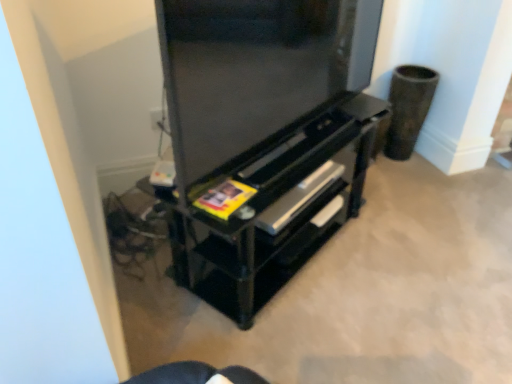
What do you see at coordinates (264, 137) in the screenshot? This screenshot has width=512, height=384. I see `black glossy tv stand at center` at bounding box center [264, 137].

The image size is (512, 384). Find the location of `black glossy tv stand at center`. black glossy tv stand at center is located at coordinates (264, 137).

Consider the image. What is the approximate height of black glossy tv stand at center?

black glossy tv stand at center is 20.04 inches tall.

Where is `black glossy tv stand at center`? The image size is (512, 384). black glossy tv stand at center is located at coordinates (264, 137).